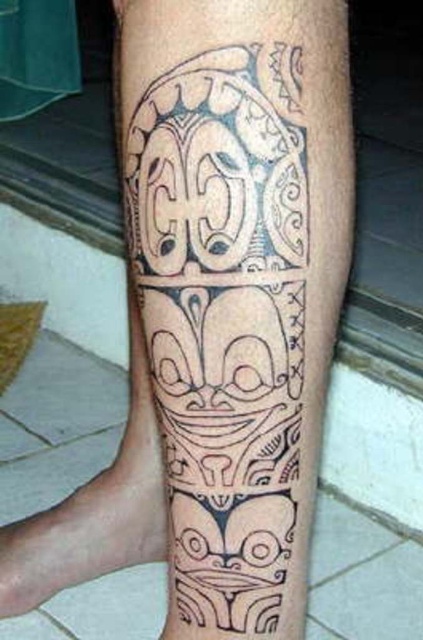
You are an artist trying to replicate the tattoo design. You want to ensure the black ink tattoo at center and the black ink tattoo at lower left are positioned correctly. Based on the scene, which tattoo should you draw first to maintain the correct spatial relationship?

The black ink tattoo at center should be drawn first because it is closer to the viewer than the black ink tattoo at lower left, so it should appear in front spatially.

You are a tattoo artist assessing the placement of two black ink tattoos on a client. The client has a black ink tattoo at center and a black ink tattoo at lower left. Based on their sizes, which tattoo would require more ink?

The black ink tattoo at lower left requires more ink because its width is greater than the black ink tattoo at center.

You are a photographer standing 20 inches away from a person. You want to take a closeup shot of the black ink tattoo at center. Is the person currently within your ideal shooting distance?

The black ink tattoo at center is 19.55 inches away from the viewer. Since your ideal distance is 20 inches, the person is slightly closer than the ideal distance required for a closeup shot.